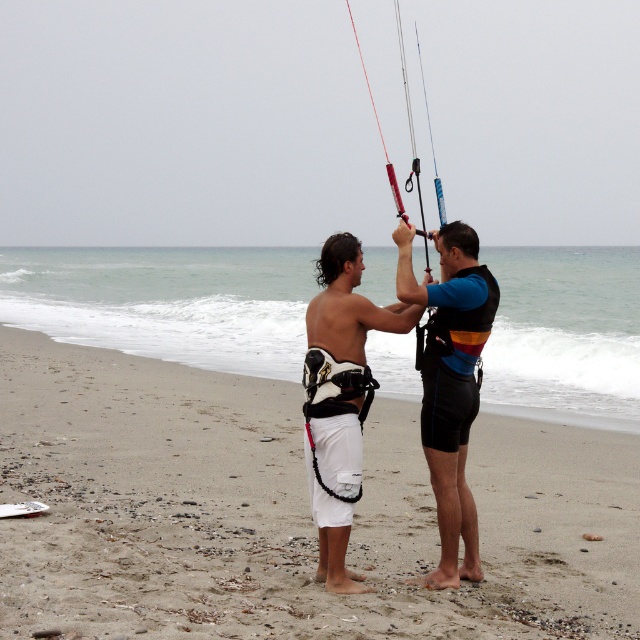
You are a beach safety inspector checking the beach for potential hazards. You notice the white sand at center and the black neoprene wetsuit at center. Which object is wider?

The white sand at center is wider than the black neoprene wetsuit at center.